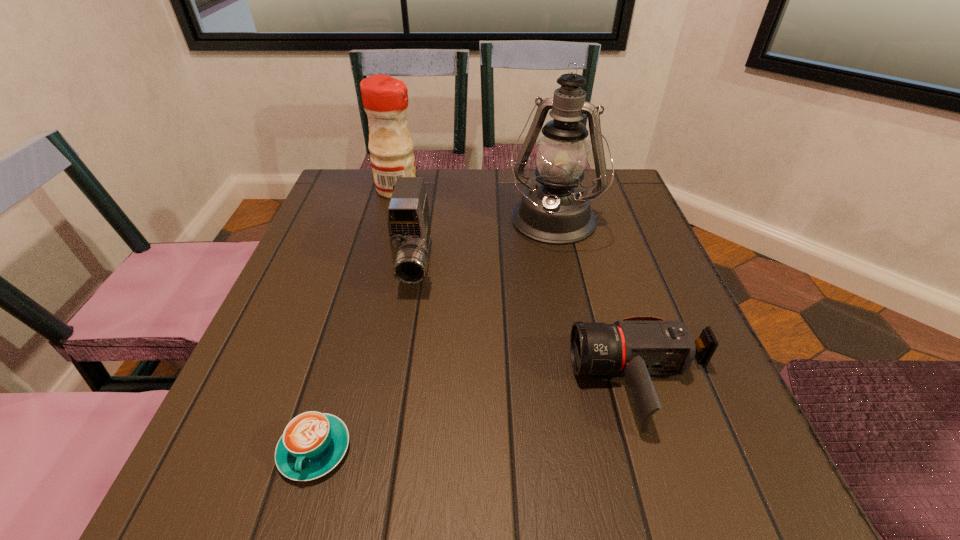
The width and height of the screenshot is (960, 540). Find the location of `the tallest object`. the tallest object is located at coordinates (556, 211).

Identify the location of the second tallest object. (385, 99).

Identify the location of the left camcorder. Image resolution: width=960 pixels, height=540 pixels. coord(408,222).

Image resolution: width=960 pixels, height=540 pixels. Identify the location of the taller camcorder. (408, 222).

You are a GUI agent. You are given a task and a screenshot of the screen. Output one action in this format:
    pyautogui.click(x=<x>, y=<y>)
    Task: Click on the shorter camcorder
    
    Given the screenshot: What is the action you would take?
    pyautogui.click(x=636, y=347)

Where is `the nearer camcorder`? This screenshot has width=960, height=540. the nearer camcorder is located at coordinates (636, 347).

The image size is (960, 540). In order to click on cappuccino in this screenshot , I will do `click(313, 443)`.

Find the location of a particular element. The image size is (960, 540). blank area located on the left of the tallest object is located at coordinates (391, 224).

Locate an element on the screen. vacant space located 0.230m on the right of the condiment is located at coordinates (505, 190).

Where is `vacant space situated 0.150m at the front of the farther camcorder, highlighting the lens`? This screenshot has height=540, width=960. vacant space situated 0.150m at the front of the farther camcorder, highlighting the lens is located at coordinates (399, 361).